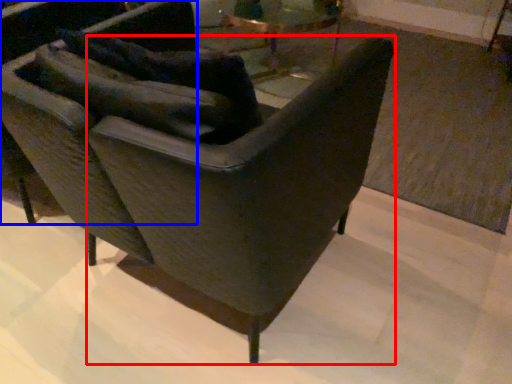
Question: Which object appears farthest to the camera in this image, rocking chair (highlighted by a red box) or chair (highlighted by a blue box)?

Choices:
 (A) rocking chair
 (B) chair

Answer: (B)